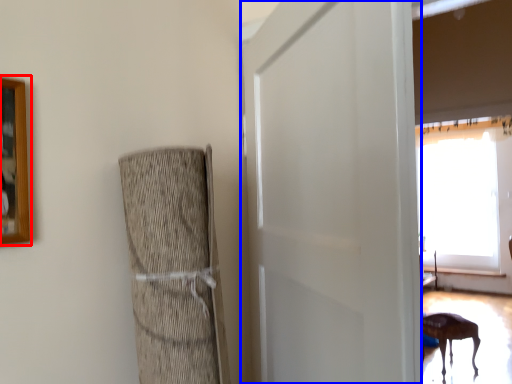
Question: Which point is further to the camera, picture frame (highlighted by a red box) or screen door (highlighted by a blue box)?

Choices:
 (A) picture frame
 (B) screen door

Answer: (A)